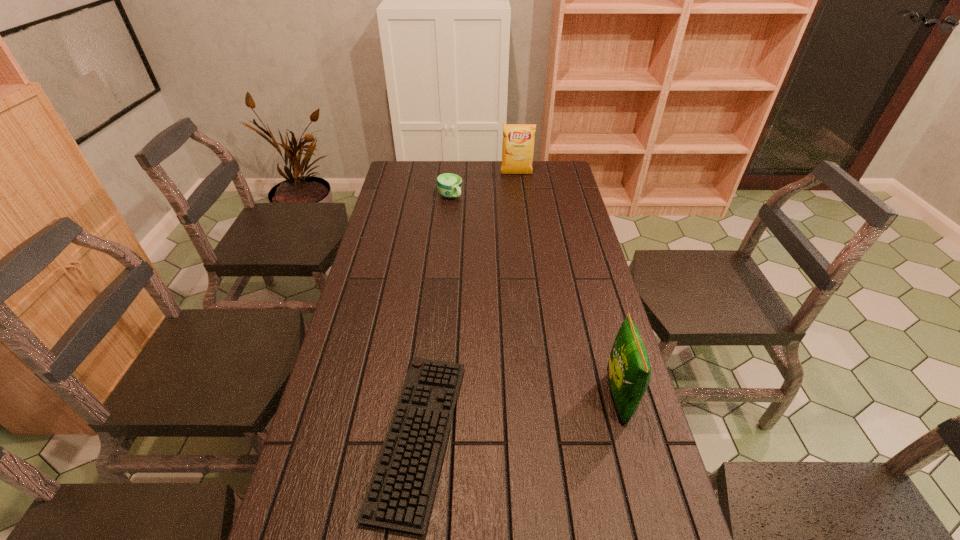
The image size is (960, 540). I want to click on the closest object to the second shortest object, so click(x=518, y=140).

Point out which object is positioned as the second nearest to the computer keyboard. Please provide its 2D coordinates. Your answer should be formatted as a tuple, i.e. [(x, y)], where the tuple contains the x and y coordinates of a point satisfying the conditions above.

[(448, 185)]

Identify the location of free region that satisfies the following two spatial constraints: 1. on the front-facing side of the rightmost object; 2. on the front side of the shortest object. This screenshot has height=540, width=960. (628, 436).

The height and width of the screenshot is (540, 960). Find the location of `free space that satisfies the following two spatial constraints: 1. on the back side of the shortest object; 2. on the left side of the second shortest object`. free space that satisfies the following two spatial constraints: 1. on the back side of the shortest object; 2. on the left side of the second shortest object is located at coordinates [445, 197].